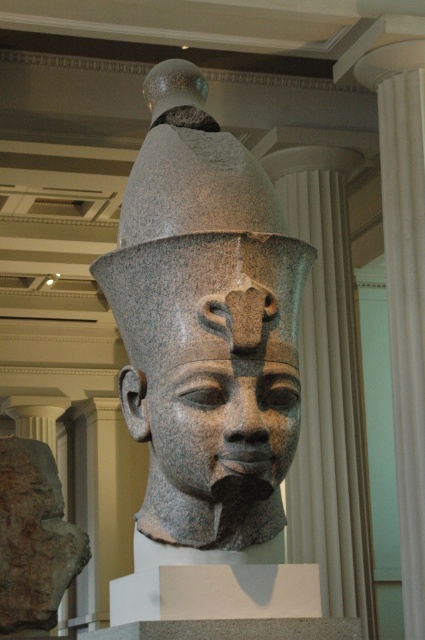
Question: Which point is farther from the camera taking this photo?

Choices:
 (A) (405, 548)
 (B) (155, 524)

Answer: (A)

Question: Considering the real-world distances, which object is closest to the granite statue at center?

Choices:
 (A) granite statue head at center
 (B) white marble column at right

Answer: (A)

Question: Is granite statue at center positioned at the back of white marble column at right?

Choices:
 (A) yes
 (B) no

Answer: (B)

Question: Can you confirm if white marble column at right is thinner than granite statue head at center?

Choices:
 (A) yes
 (B) no

Answer: (B)

Question: Is granite statue at center to the right of granite statue head at center from the viewer's perspective?

Choices:
 (A) yes
 (B) no

Answer: (B)

Question: Which of the following is the closest to the observer?

Choices:
 (A) (385, 44)
 (B) (241, 356)
 (C) (104, 276)

Answer: (B)